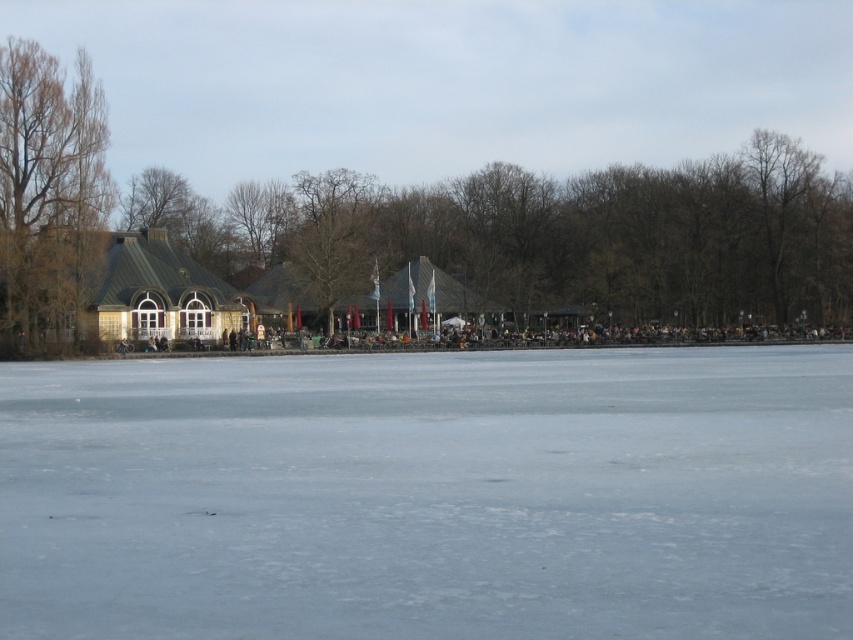
You are standing at the edge of the frozen lake and see the transparent ice at center and the brown leafless tree at left. Which object is nearer to you?

The transparent ice at center is closer to the viewer than the brown leafless tree at left.

You are standing at the edge of the frozen lake and want to reach a specific point marked at coordinates point [35,616]. If your walking speed is 1.2 meters per second, how many seconds will it take you to reach that point?

The distance of point [35,616] from viewer is 8.32 meters. At a speed of 1.2 meters per second, it will take approximately 6.93 seconds to reach the point.